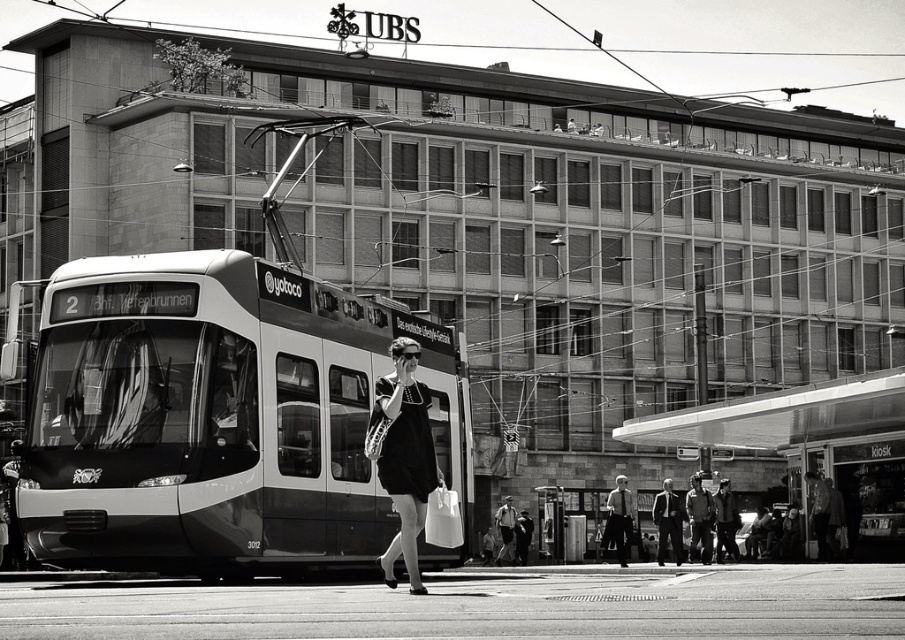
Consider the image. Who is higher up, black matte dress at center or dark suit at center?

black matte dress at center is higher up.

The image size is (905, 640). I want to click on black matte dress at center, so click(x=405, y=456).

In order to click on black matte dress at center in this screenshot , I will do click(405, 456).

Who is lower down, dark gray jacket at center or smooth leather jacket at lower right?

dark gray jacket at center is below.

Can you confirm if dark gray jacket at center is positioned above smooth leather jacket at lower right?

Incorrect, dark gray jacket at center is not positioned above smooth leather jacket at lower right.

Image resolution: width=905 pixels, height=640 pixels. What do you see at coordinates (725, 522) in the screenshot? I see `dark gray jacket at center` at bounding box center [725, 522].

The image size is (905, 640). What are the coordinates of `dark gray jacket at center` in the screenshot? It's located at (725, 522).

Can you confirm if black silk tie at center is positioned below dark gray jacket at center?

Yes, black silk tie at center is below dark gray jacket at center.

Does black silk tie at center have a greater height compared to dark gray jacket at center?

Yes.

Measure the distance between point (616,484) and camera.

Point (616,484) is 33.73 meters from camera.

This screenshot has width=905, height=640. Identify the location of black silk tie at center. (618, 518).